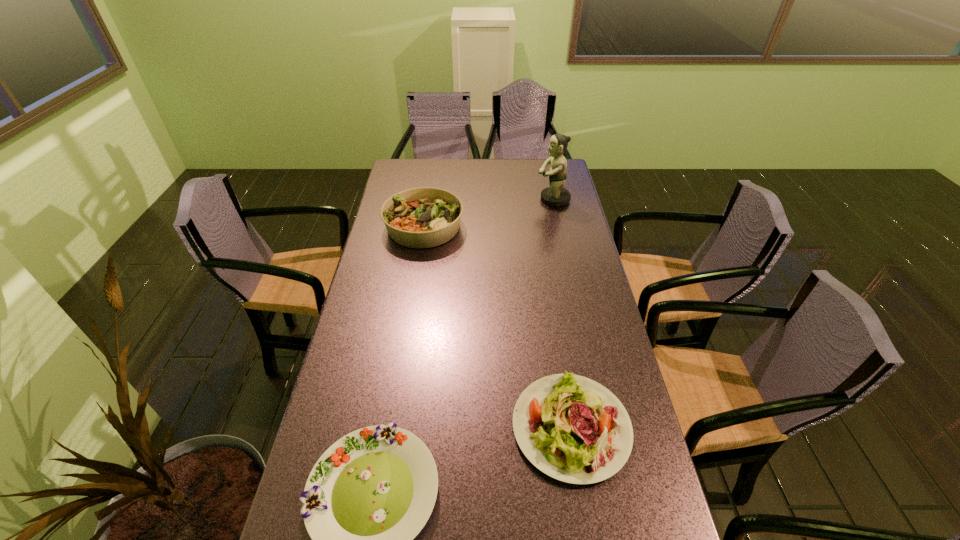
This screenshot has width=960, height=540. I want to click on object that is at the left edge, so click(424, 217).

The image size is (960, 540). I want to click on figurine that is at the right edge, so click(555, 195).

Where is `salad plate located in the right edge section of the desktop`? The width and height of the screenshot is (960, 540). salad plate located in the right edge section of the desktop is located at coordinates (572, 428).

In the image, there is a desktop. At what (x,y) coordinates should I click in order to perform the action: click on vacant space at the left edge. Please return your answer as a coordinate pair (x, y). Looking at the image, I should click on (371, 249).

Locate an element on the screen. This screenshot has height=540, width=960. vacant space at the right edge is located at coordinates (595, 509).

At what (x,y) coordinates should I click in order to perform the action: click on vacant region at the far left corner. Please return your answer as a coordinate pair (x, y). This screenshot has width=960, height=540. Looking at the image, I should click on (426, 167).

Find the location of `free point between the second tallest salad plate and the tallest object`. free point between the second tallest salad plate and the tallest object is located at coordinates (562, 313).

I want to click on free point between the third shortest object and the second tallest salad plate, so click(497, 327).

Where is `free space that is in between the tallest object and the rightmost salad plate`? free space that is in between the tallest object and the rightmost salad plate is located at coordinates (562, 313).

Locate an element on the screen. The height and width of the screenshot is (540, 960). empty location between the third tallest object and the tallest salad plate is located at coordinates (497, 327).